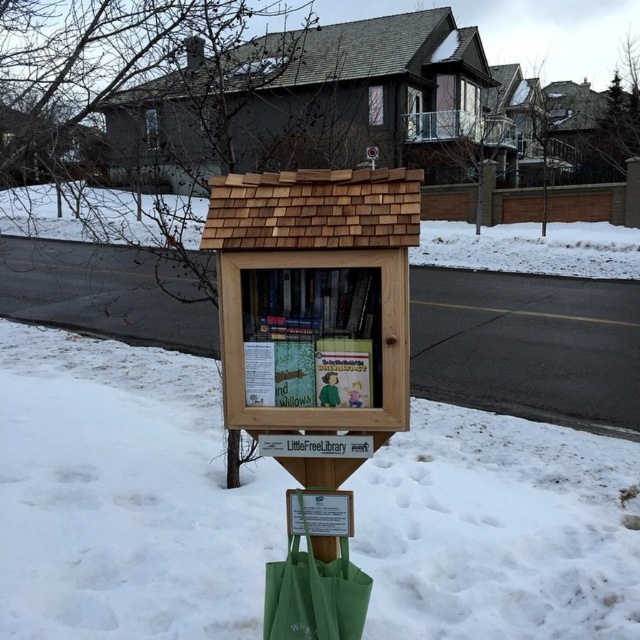
Question: Is hardcover book at center to the right of green canvas bag at lower center from the viewer's perspective?

Choices:
 (A) yes
 (B) no

Answer: (A)

Question: Is hardcover book at center bigger than green canvas bag at lower center?

Choices:
 (A) yes
 (B) no

Answer: (B)

Question: Is hardcover book at center to the left of green canvas bag at lower center from the viewer's perspective?

Choices:
 (A) yes
 (B) no

Answer: (B)

Question: Among these objects, which one is farthest from the camera?

Choices:
 (A) hardcover book at center
 (B) green canvas bag at lower center

Answer: (B)